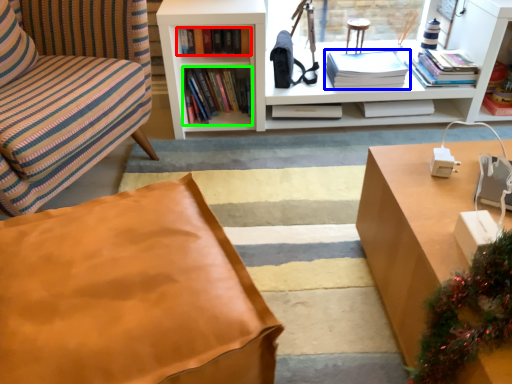
Question: Which object is the closest to the book (highlighted by a red box)? Choose among these: book (highlighted by a blue box) or book (highlighted by a green box).

Choices:
 (A) book
 (B) book

Answer: (B)